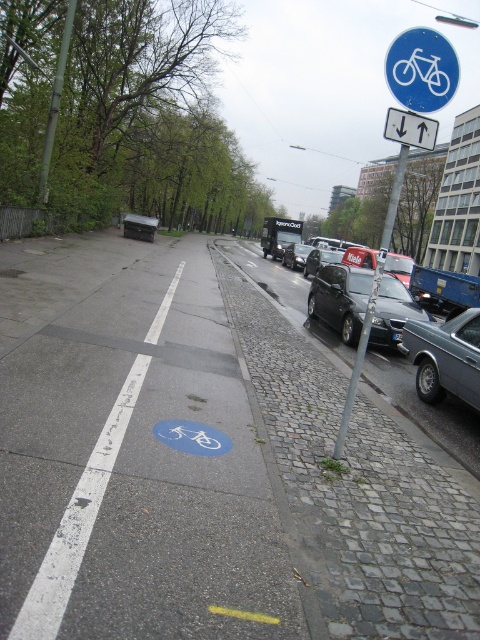
Between shiny black sedan at center and shiny silver car at center, which one appears on the left side from the viewer's perspective?

shiny black sedan at center

Where is `shiny black sedan at center`? shiny black sedan at center is located at coordinates (339, 298).

Is white plastic bicycle at upper right positioned behind metallic silver car at center?

No, white plastic bicycle at upper right is in front of metallic silver car at center.

Which is below, white plastic bicycle at upper right or metallic silver car at center?

white plastic bicycle at upper right is lower down.

Is point (432, 54) closer to camera compared to point (136, 234)?

That is True.

In order to click on white plastic bicycle at upper right in this screenshot , I will do `click(421, 72)`.

Does point (373, 330) come in front of point (289, 248)?

Yes, point (373, 330) is closer to viewer.

Locate an element on the screen. The width and height of the screenshot is (480, 640). shiny black sedan at center is located at coordinates (339, 298).

Which is in front, point (348, 328) or point (282, 257)?

Positioned in front is point (348, 328).

This screenshot has height=640, width=480. What are the coordinates of `shiny black sedan at center` in the screenshot? It's located at (339, 298).